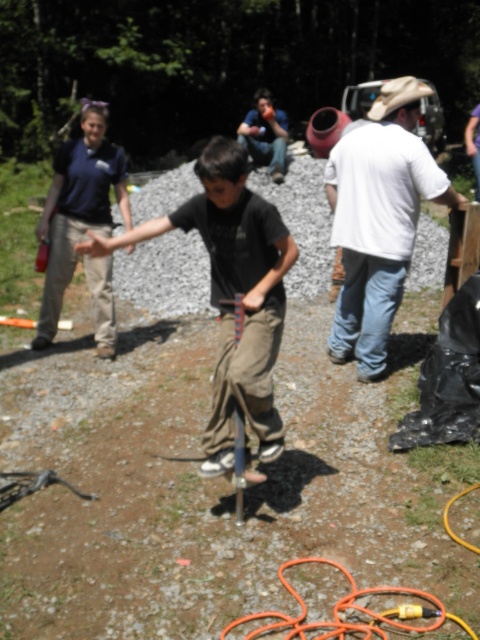
You are a delivery person who needs to place a package between the matte black shirt at center and the orange rubber hose at lower center. Which object should you place the package closer to if you want it to be on the left side of the hose?

You should place the package closer to the matte black shirt at center because it is already on the left side of the orange rubber hose at lower center.

You are standing at the position of the viewer and want to hand a tool to the person wearing the matte black shirt at center. If your arm can reach 1.8 meters, can you reach them?

The matte black shirt at center is 2.69 meters away from the viewer. Since your arm can only reach 1.8 meters, you cannot reach them.